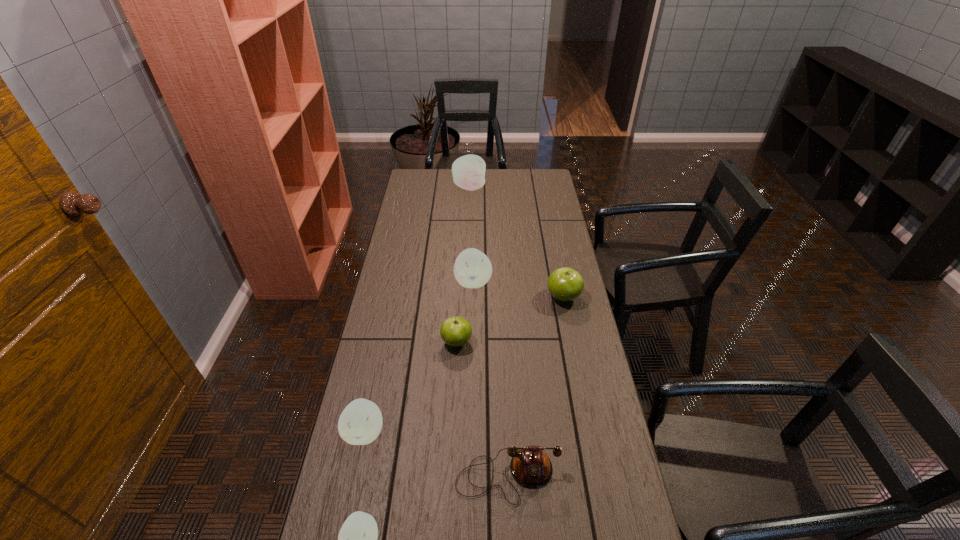
Locate an element on the screen. This screenshot has width=960, height=540. object that is the third closest one to the second farthest white apple is located at coordinates (360, 423).

Identify which apple is the fifth closest to the biggest white apple. Please provide its 2D coordinates. Your answer should be formatted as a tuple, i.e. [(x, y)], where the tuple contains the x and y coordinates of a point satisfying the conditions above.

[(357, 539)]

Locate which apple is the fifth closest to the rightmost apple. Please provide its 2D coordinates. Your answer should be formatted as a tuple, i.e. [(x, y)], where the tuple contains the x and y coordinates of a point satisfying the conditions above.

[(357, 539)]

Where is `white apple identified as the closest to the second biggest white apple`? Image resolution: width=960 pixels, height=540 pixels. white apple identified as the closest to the second biggest white apple is located at coordinates (360, 423).

Locate an element on the screen. white apple object that ranks as the closest to the farther green apple is located at coordinates (472, 269).

The width and height of the screenshot is (960, 540). Identify the location of green apple that is the second closest to the pink telephone. (565, 284).

At what (x,y) coordinates should I click in order to perform the action: click on free space in the image that satisfies the following two spatial constraints: 1. on the back side of the nearer green apple; 2. on the right side of the biggest white apple. Please return your answer as a coordinate pair (x, y). Image resolution: width=960 pixels, height=540 pixels. Looking at the image, I should click on (465, 187).